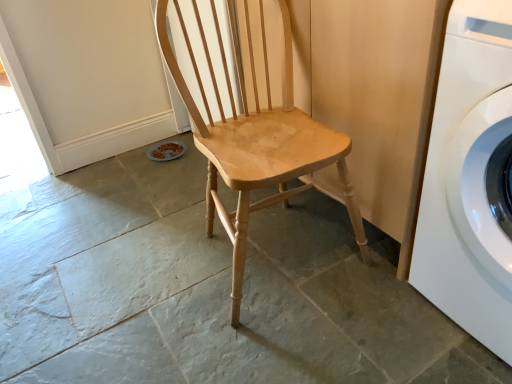
Question: Can you confirm if natural wood chair at center is taller than white glossy washing machine at right?

Choices:
 (A) yes
 (B) no

Answer: (A)

Question: Is natural wood chair at center positioned behind white glossy washing machine at right?

Choices:
 (A) yes
 (B) no

Answer: (A)

Question: From the image's perspective, is natural wood chair at center under white glossy washing machine at right?

Choices:
 (A) no
 (B) yes

Answer: (A)

Question: Are natural wood chair at center and white glossy washing machine at right located far from each other?

Choices:
 (A) yes
 (B) no

Answer: (B)

Question: Is the depth of natural wood chair at center less than that of white glossy washing machine at right?

Choices:
 (A) no
 (B) yes

Answer: (A)

Question: Is natural wood chair at center located outside white glossy washing machine at right?

Choices:
 (A) no
 (B) yes

Answer: (B)

Question: From a real-world perspective, is white glossy washing machine at right physically above natural wood chair at center?

Choices:
 (A) no
 (B) yes

Answer: (A)

Question: Are white glossy washing machine at right and natural wood chair at center beside each other?

Choices:
 (A) yes
 (B) no

Answer: (B)

Question: Is the position of white glossy washing machine at right less distant than that of natural wood chair at center?

Choices:
 (A) yes
 (B) no

Answer: (A)

Question: Is white glossy washing machine at right shorter than natural wood chair at center?

Choices:
 (A) no
 (B) yes

Answer: (B)

Question: Does white glossy washing machine at right have a larger size compared to natural wood chair at center?

Choices:
 (A) yes
 (B) no

Answer: (B)

Question: Is white glossy washing machine at right positioned with its back to natural wood chair at center?

Choices:
 (A) yes
 (B) no

Answer: (B)

Question: Is white glossy washing machine at right situated inside natural wood chair at center or outside?

Choices:
 (A) outside
 (B) inside

Answer: (A)